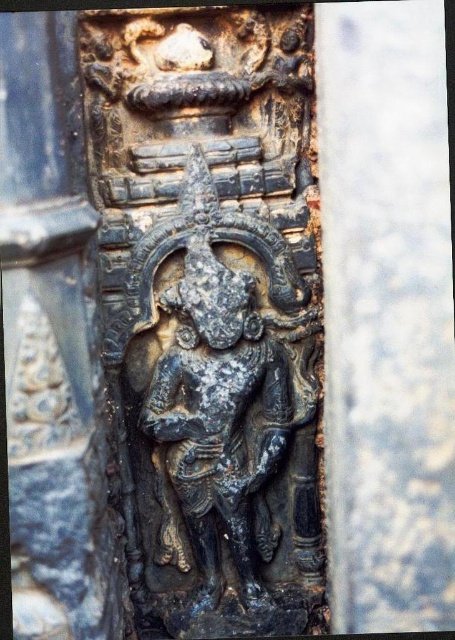
Can you confirm if black stone carving at center is positioned below dark gray stone carving at center?

No, black stone carving at center is not below dark gray stone carving at center.

Does point (254, 460) come closer to viewer compared to point (49, 154)?

No.

Where is `black stone carving at center`? black stone carving at center is located at coordinates coord(211,310).

The height and width of the screenshot is (640, 455). What do you see at coordinates (52, 346) in the screenshot? I see `dark gray stone carving at center` at bounding box center [52, 346].

Does dark gray stone carving at center have a larger size compared to dark gray stone statue at center?

Yes.

At what (x,y) coordinates should I click in order to perform the action: click on dark gray stone carving at center. Please return your answer as a coordinate pair (x, y). Looking at the image, I should click on (52, 346).

In order to click on dark gray stone carving at center in this screenshot , I will do `click(52, 346)`.

Which is in front, point (124, 483) or point (221, 513)?

Point (124, 483)

Is point (221, 12) closer to viewer compared to point (206, 392)?

No.

This screenshot has height=640, width=455. Find the location of `black stone carving at center`. black stone carving at center is located at coordinates (211, 310).